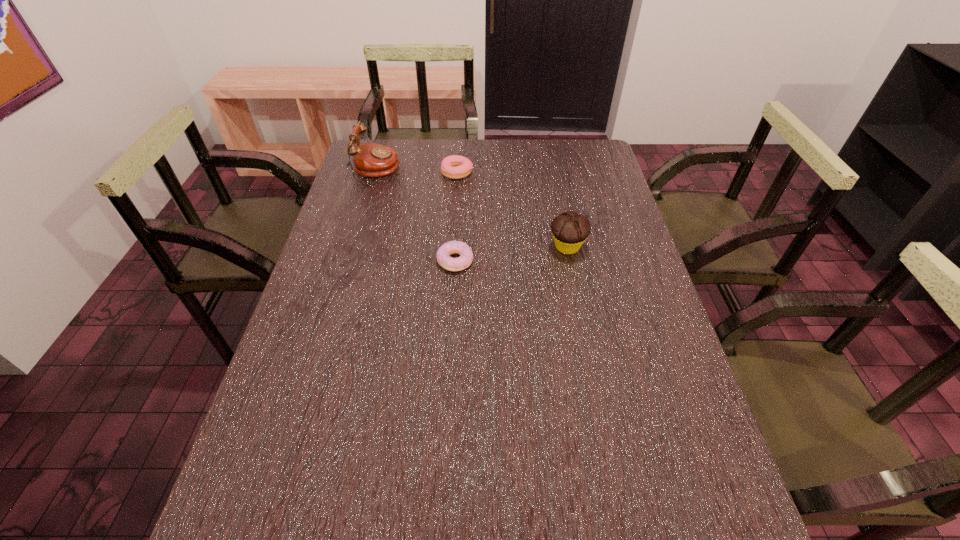
Locate an element on the screen. The width and height of the screenshot is (960, 540). telephone located at the far edge is located at coordinates (373, 160).

At what (x,y) coordinates should I click in order to perform the action: click on doughnut that is at the far edge. Please return your answer as a coordinate pair (x, y). Image resolution: width=960 pixels, height=540 pixels. Looking at the image, I should click on (454, 167).

The image size is (960, 540). Find the location of `object at the left edge`. object at the left edge is located at coordinates (373, 160).

Find the location of a particular element. object that is positioned at the right edge is located at coordinates (570, 230).

Locate an element on the screen. This screenshot has height=540, width=960. object situated at the far left corner is located at coordinates (373, 160).

The image size is (960, 540). In the image, there is a desktop. Identify the location of free space at the far edge. (441, 141).

Locate an element on the screen. This screenshot has width=960, height=540. free spot at the left edge of the desktop is located at coordinates (317, 296).

Identify the location of vacant space at the right edge of the desktop. The image size is (960, 540). (728, 509).

Find the location of a particular element. The image size is (960, 540). free spot at the far right corner of the desktop is located at coordinates (602, 162).

At what (x,y) coordinates should I click in order to perform the action: click on free space between the muffin and the nearer doughnut. Please return your answer as a coordinate pair (x, y). This screenshot has height=540, width=960. Looking at the image, I should click on (511, 254).